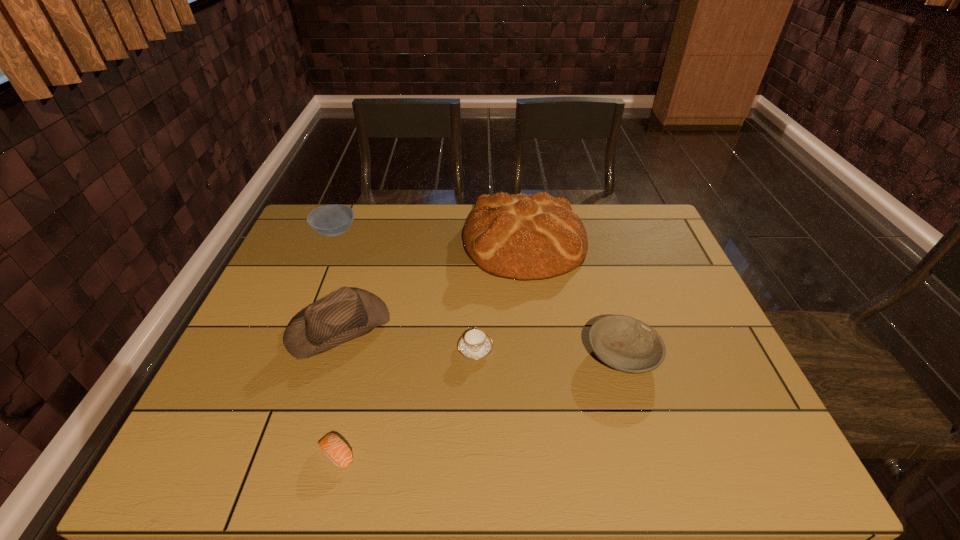
Locate an element on the screen. The height and width of the screenshot is (540, 960). vacant area that satisfies the following two spatial constraints: 1. on the side with the handle of the fifth tallest object; 2. on the right side of the tallest object is located at coordinates (476, 241).

Where is `vacant space that satisfies the following two spatial constraints: 1. on the front side of the left bowl; 2. on the left side of the shortest object`? vacant space that satisfies the following two spatial constraints: 1. on the front side of the left bowl; 2. on the left side of the shortest object is located at coordinates (243, 455).